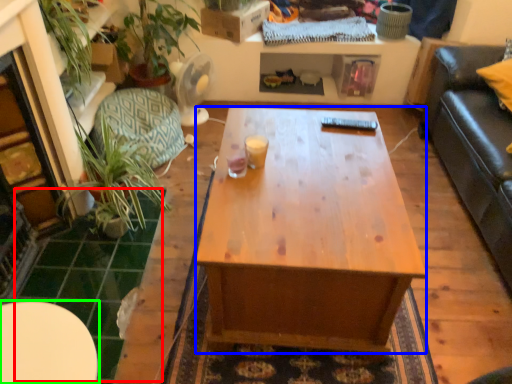
Question: Which object is positioned closest to tile (highlighted by a red box)? Select from desk (highlighted by a blue box) and table (highlighted by a green box).

Choices:
 (A) desk
 (B) table

Answer: (B)